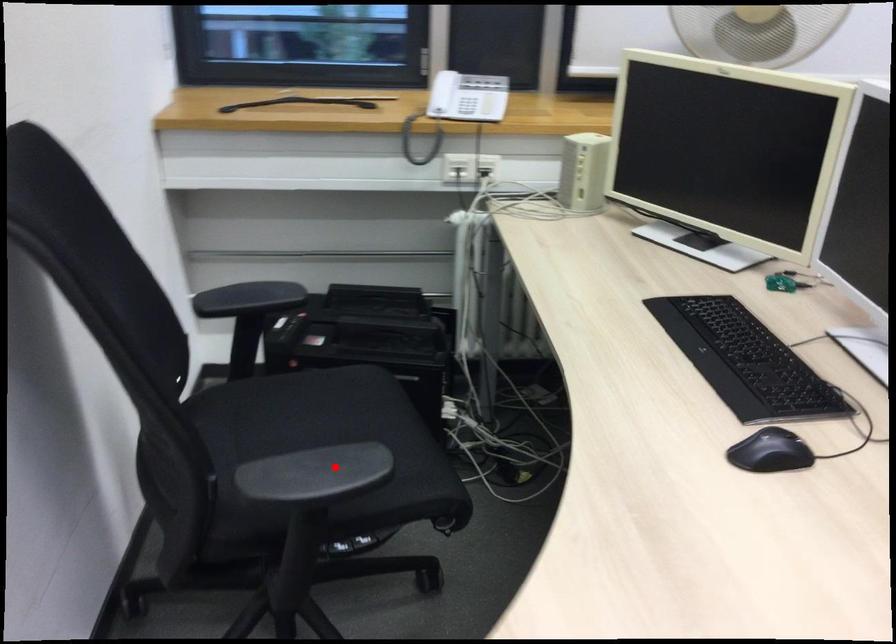
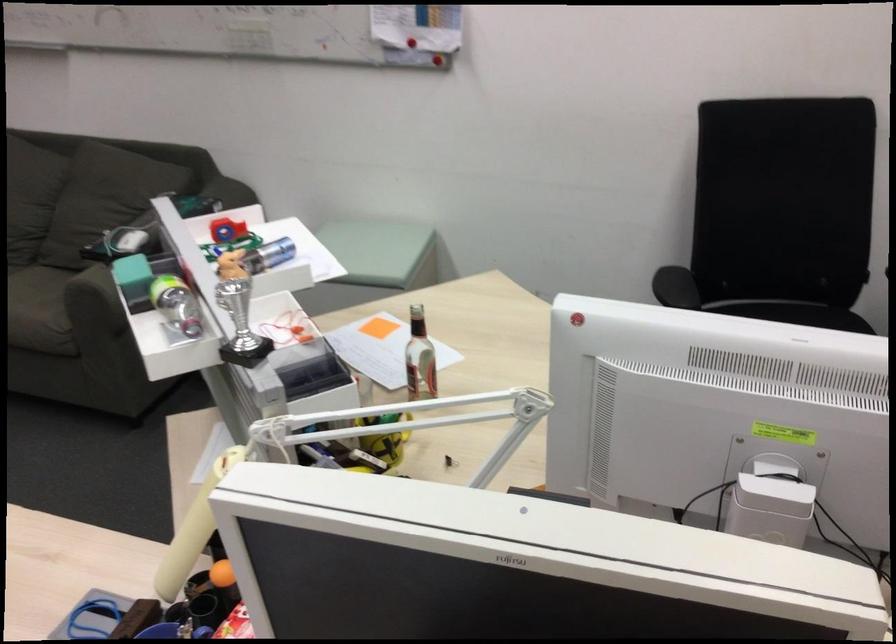
Question: I am providing you with two images of the same scene from different viewpoints. A red point is shown in image1. For the corresponding object point in image2, is it positioned nearer or farther from the camera?

Choices:
 (A) Nearer
 (B) Farther

Answer: (B)